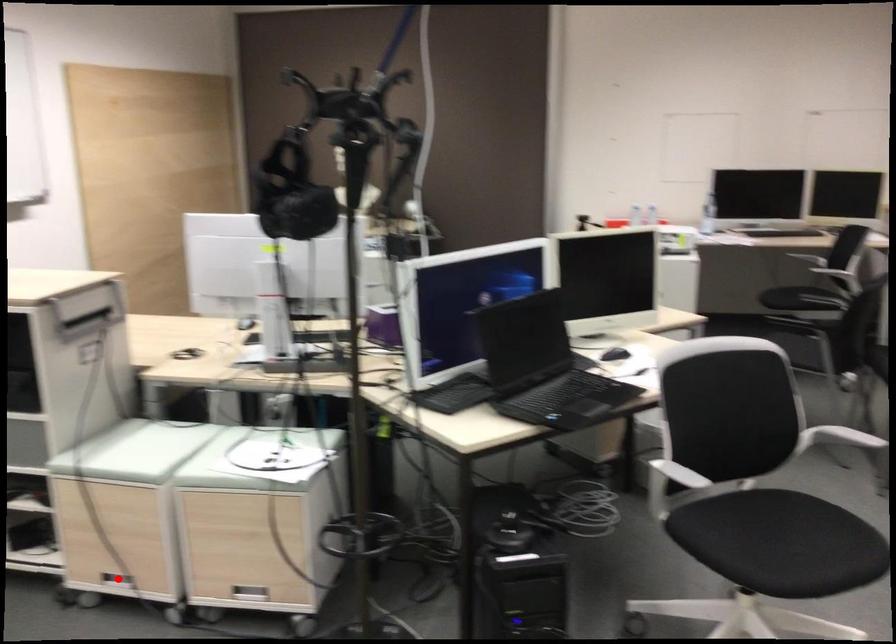
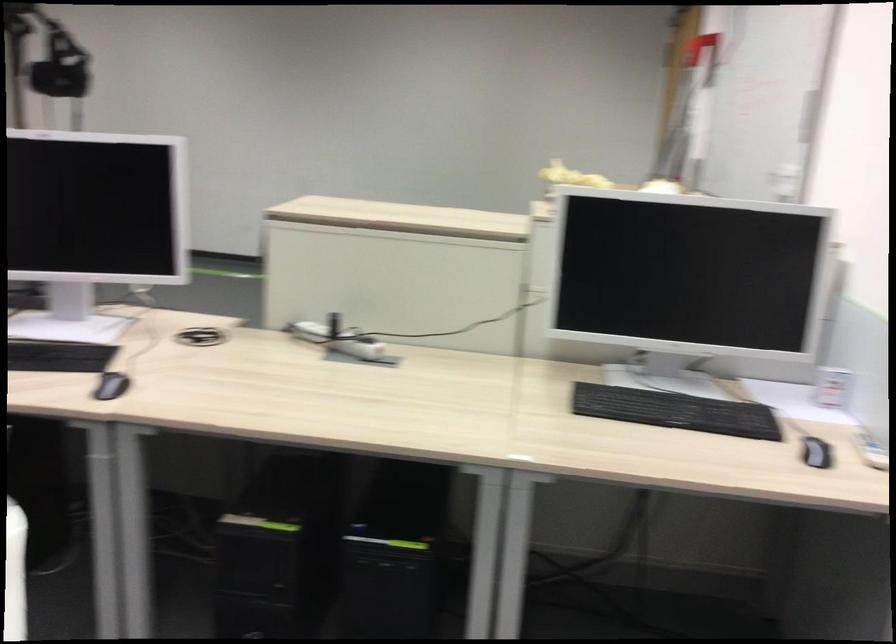
Question: I am providing you with two images of the same scene from different viewpoints. A red point is marked on the first image. At the location where the point appears in image 1, is it still visible in image 2?

Choices:
 (A) Yes
 (B) No

Answer: (B)